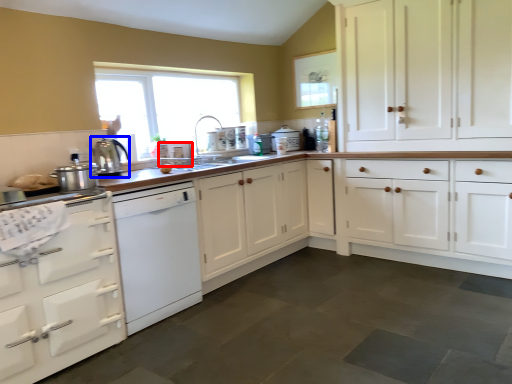
Question: Which point is further to the camera, appliance (highlighted by a red box) or kitchen appliance (highlighted by a blue box)?

Choices:
 (A) appliance
 (B) kitchen appliance

Answer: (A)